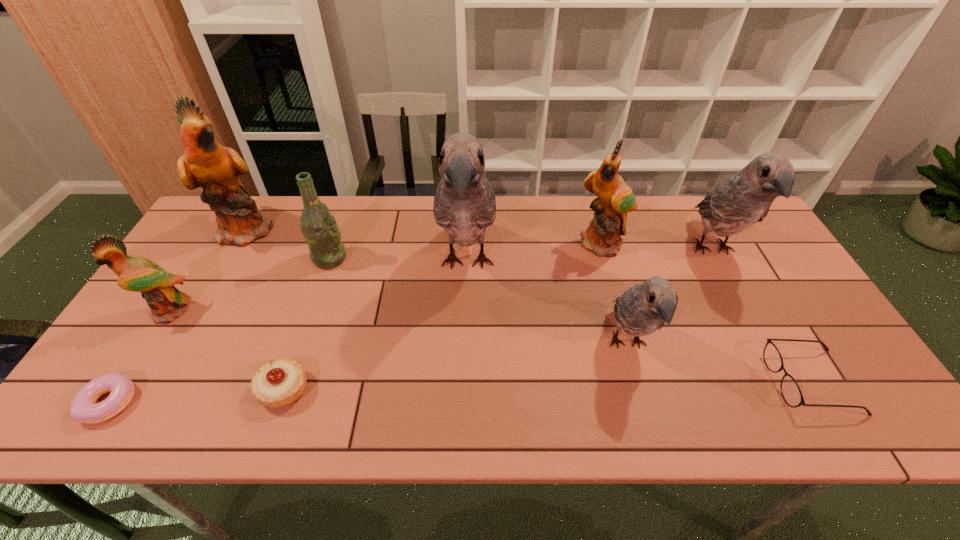
Where is `vacant space located on the front-facing side of the second gray parrot from right to left`? Image resolution: width=960 pixels, height=540 pixels. vacant space located on the front-facing side of the second gray parrot from right to left is located at coordinates (648, 420).

You are a GUI agent. You are given a task and a screenshot of the screen. Output one action in this format:
    pyautogui.click(x=<x>, y=<y>)
    Task: Click on the free space located on the right of the beige pastry
    
    Given the screenshot: What is the action you would take?
    pyautogui.click(x=449, y=390)

This screenshot has height=540, width=960. In order to click on free location located on the front-facing side of the spectacles in this screenshot , I will do coord(683,382).

Locate an element on the screen. The width and height of the screenshot is (960, 540). vacant position located on the front-facing side of the spectacles is located at coordinates click(x=674, y=382).

I want to click on free space located 0.210m on the front-facing side of the spectacles, so click(x=683, y=382).

I want to click on vacant area situated 0.400m on the back of the shortest object, so click(200, 260).

The image size is (960, 540). In order to click on pastry that is at the near edge in this screenshot , I will do `click(279, 383)`.

I want to click on spectacles that is at the near edge, so click(x=790, y=390).

Find the location of a particular element. doughnut that is at the near edge is located at coordinates (83, 408).

You are a GUI agent. You are given a task and a screenshot of the screen. Output one action in this format:
    pyautogui.click(x=<x>, y=<y>)
    Task: Click on the doughnut present at the left edge
    The height and width of the screenshot is (540, 960).
    Given the screenshot: What is the action you would take?
    pyautogui.click(x=83, y=408)